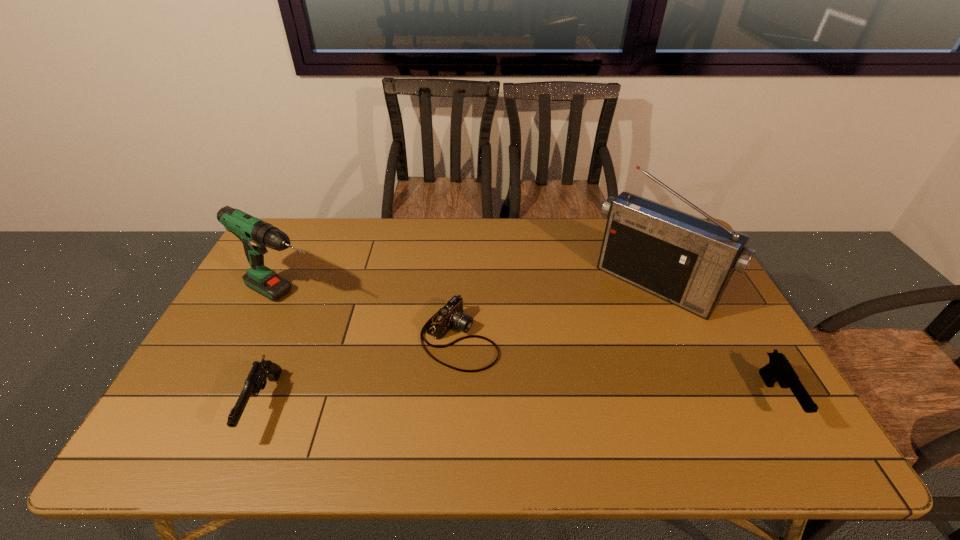
Where is `free location located 0.220m on the front-facing side of the tallest object`? The width and height of the screenshot is (960, 540). free location located 0.220m on the front-facing side of the tallest object is located at coordinates (587, 360).

Find the location of a particular element. The width and height of the screenshot is (960, 540). free location located on the front-facing side of the tallest object is located at coordinates (570, 380).

This screenshot has height=540, width=960. Identify the location of free region located on the front-facing side of the camera. (509, 365).

At what (x,y) coordinates should I click in order to perform the action: click on vacant space located 0.270m on the front-facing side of the camera. Please return your answer as a coordinate pair (x, y). Looking at the image, I should click on (588, 406).

This screenshot has height=540, width=960. Find the location of `vacant space located on the front-facing side of the camera`. vacant space located on the front-facing side of the camera is located at coordinates (562, 392).

Image resolution: width=960 pixels, height=540 pixels. Find the location of `object that is positioned at the far edge`. object that is positioned at the far edge is located at coordinates (685, 260).

Locate an element on the screen. The width and height of the screenshot is (960, 540). gun that is at the near edge is located at coordinates (257, 378).

The height and width of the screenshot is (540, 960). I want to click on pistol present at the near edge, so click(x=778, y=369).

The height and width of the screenshot is (540, 960). I want to click on object present at the left edge, so click(255, 234).

Locate an element on the screen. Image resolution: width=960 pixels, height=540 pixels. pistol present at the right edge is located at coordinates (778, 369).